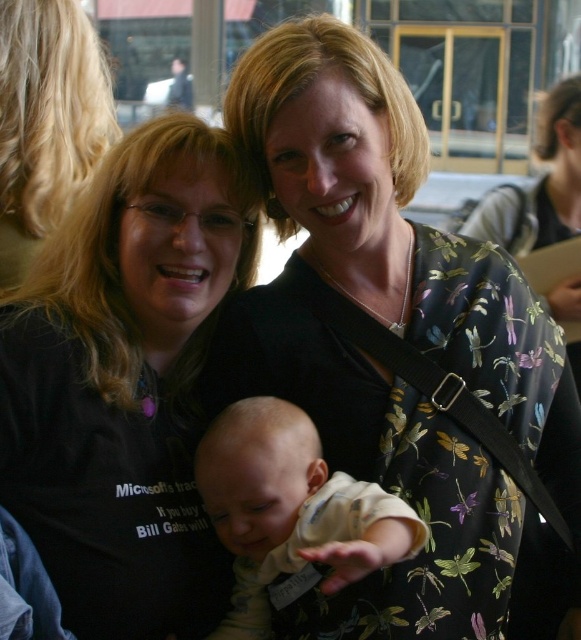
Question: Can you confirm if floral-patterned dress at center is smaller than light beige soft fabric baby at center?

Choices:
 (A) yes
 (B) no

Answer: (B)

Question: Which point appears closest to the camera in this image?

Choices:
 (A) (77, 17)
 (B) (34, 499)

Answer: (B)

Question: Which is nearer to the floral-patterned dress at center?

Choices:
 (A) black fabric shirt at upper left
 (B) black matte shirt at left
 (C) light beige soft fabric baby at center

Answer: (C)

Question: Does floral-patterned dress at center have a greater width compared to black fabric shirt at upper left?

Choices:
 (A) no
 (B) yes

Answer: (B)

Question: Is black matte shirt at left above light beige soft fabric baby at center?

Choices:
 (A) no
 (B) yes

Answer: (B)

Question: Among these points, which one is farthest from the camera?

Choices:
 (A) (62, 60)
 (B) (568, 433)

Answer: (A)